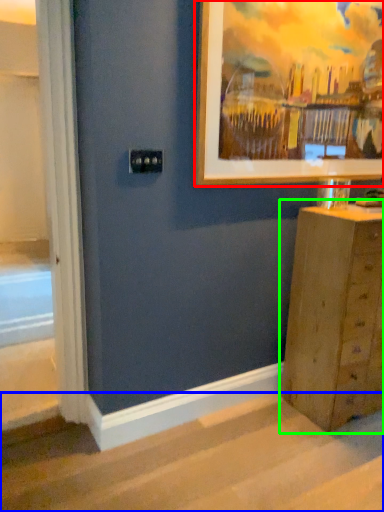
Question: Which is nearer to the picture frame (highlighted by a red box)? stairwell (highlighted by a blue box) or chest of drawers (highlighted by a green box).

Choices:
 (A) stairwell
 (B) chest of drawers

Answer: (B)